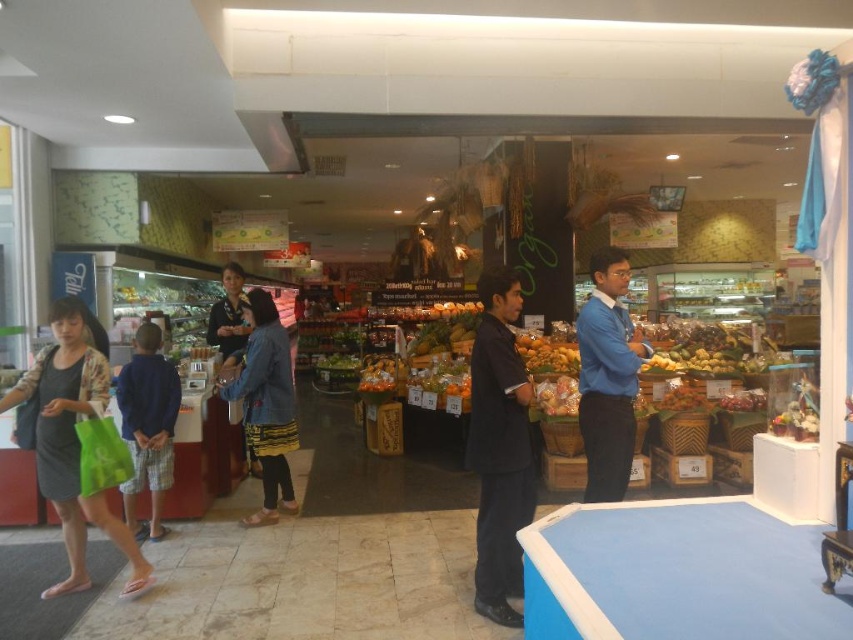
Question: Estimate the real-world distances between objects in this image. Which object is farther from the matte green bag at lower left?

Choices:
 (A) denim jacket at center
 (B) black matte shirt at center
 (C) blue smooth shirt at center

Answer: (C)

Question: Is black matte shirt at center below matte green bag at lower left?

Choices:
 (A) no
 (B) yes

Answer: (A)

Question: Is black matte shirt at center closer to camera compared to blue smooth shirt at center?

Choices:
 (A) no
 (B) yes

Answer: (B)

Question: Among these points, which one is nearest to the camera?

Choices:
 (A) (265, 490)
 (B) (55, 349)

Answer: (B)

Question: Estimate the real-world distances between objects in this image. Which object is closer to the black matte shirt at center?

Choices:
 (A) matte green bag at lower left
 (B) denim jacket at center

Answer: (B)

Question: Does black matte shirt at center have a larger size compared to denim jacket at center?

Choices:
 (A) yes
 (B) no

Answer: (B)